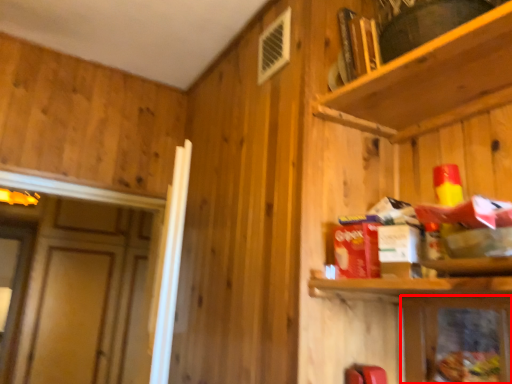
Question: From the image's perspective, considering the relative positions of cabinetry (annotated by the red box) and shelf in the image provided, where is cabinetry (annotated by the red box) located with respect to the staircase?

Choices:
 (A) below
 (B) above

Answer: (A)